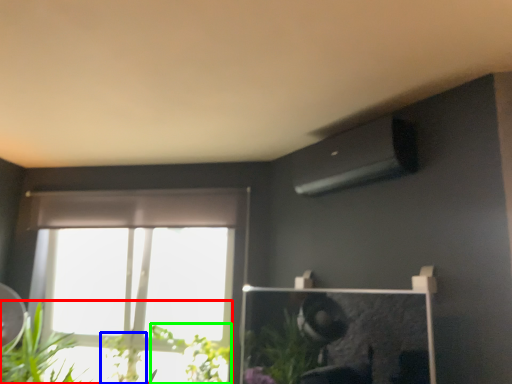
Question: Which is nearer to the houseplant (highlighted by a red box)? plant (highlighted by a blue box) or plant (highlighted by a green box).

Choices:
 (A) plant
 (B) plant

Answer: (A)